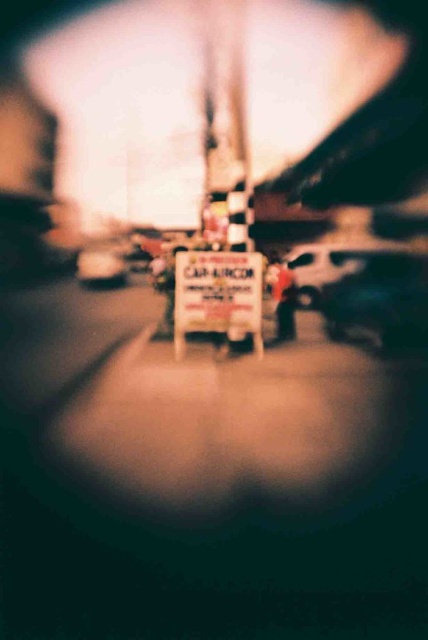
Between yellow paper sign at center and metallic silver car at center, which one appears on the right side from the viewer's perspective?

yellow paper sign at center is more to the right.

Consider the image. Is yellow paper sign at center to the left of metallic silver car at center from the viewer's perspective?

Incorrect, yellow paper sign at center is not on the left side of metallic silver car at center.

Which is behind, point (196, 262) or point (121, 276)?

The point (121, 276) is behind.

The image size is (428, 640). Find the location of `yellow paper sign at center`. yellow paper sign at center is located at coordinates (217, 292).

Is shiny black car at center to the right of metallic silver car at center from the viewer's perspective?

Correct, you'll find shiny black car at center to the right of metallic silver car at center.

Does shiny black car at center have a greater height compared to metallic silver car at center?

Correct, shiny black car at center is much taller as metallic silver car at center.

Is point (419, 289) in front of point (85, 276)?

Yes, point (419, 289) is closer to viewer.

Identify the location of shiny black car at center. (377, 300).

What do you see at coordinates (339, 268) in the screenshot? I see `metallic silver van at center` at bounding box center [339, 268].

Does metallic silver van at center have a lesser width compared to metallic silver car at center?

In fact, metallic silver van at center might be wider than metallic silver car at center.

Is point (326, 284) positioned after point (86, 280)?

No, (326, 284) is closer to viewer.

Image resolution: width=428 pixels, height=640 pixels. In order to click on metallic silver van at center in this screenshot , I will do `click(339, 268)`.